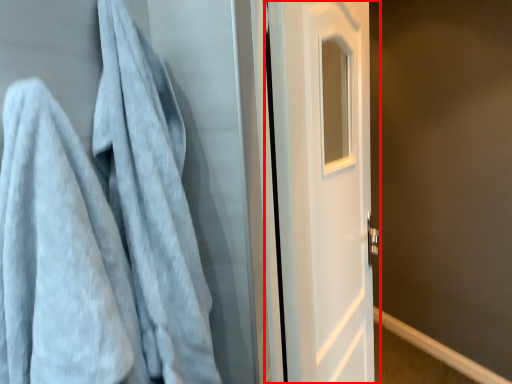
Question: From the image's perspective, what is the correct spatial relationship of door (annotated by the red box) in relation to towel?

Choices:
 (A) below
 (B) above

Answer: (A)